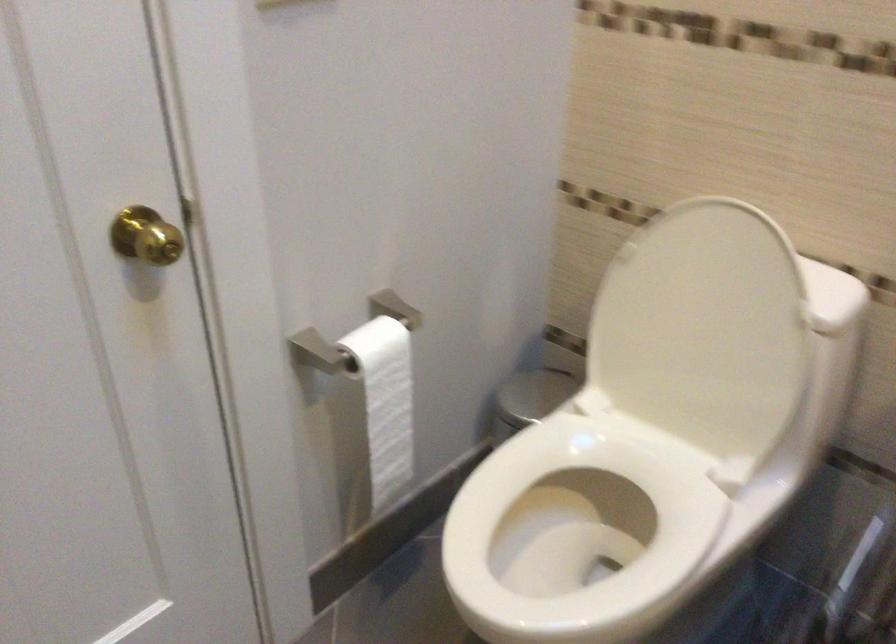
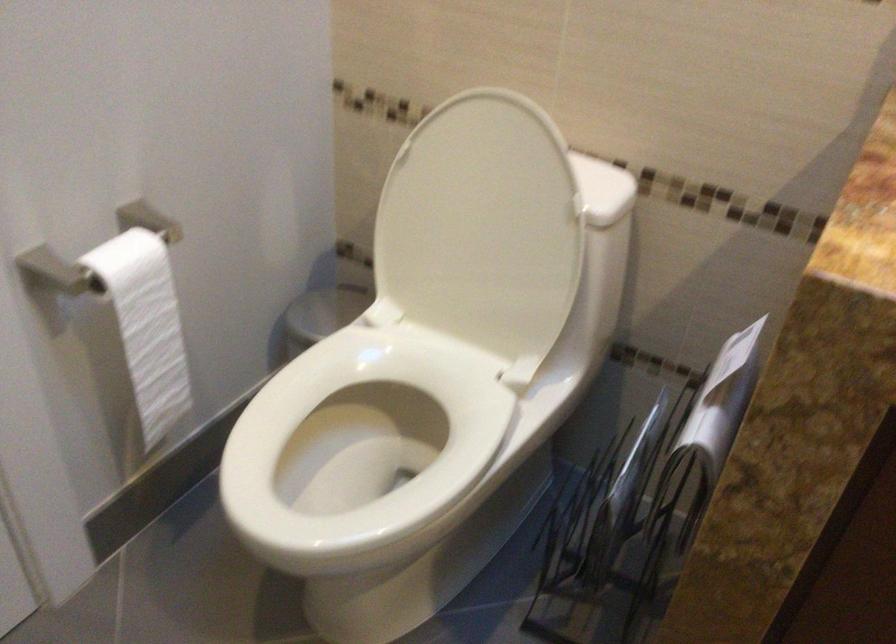
The point at (702, 328) is marked in the first image. Where is the corresponding point in the second image?

(483, 228)